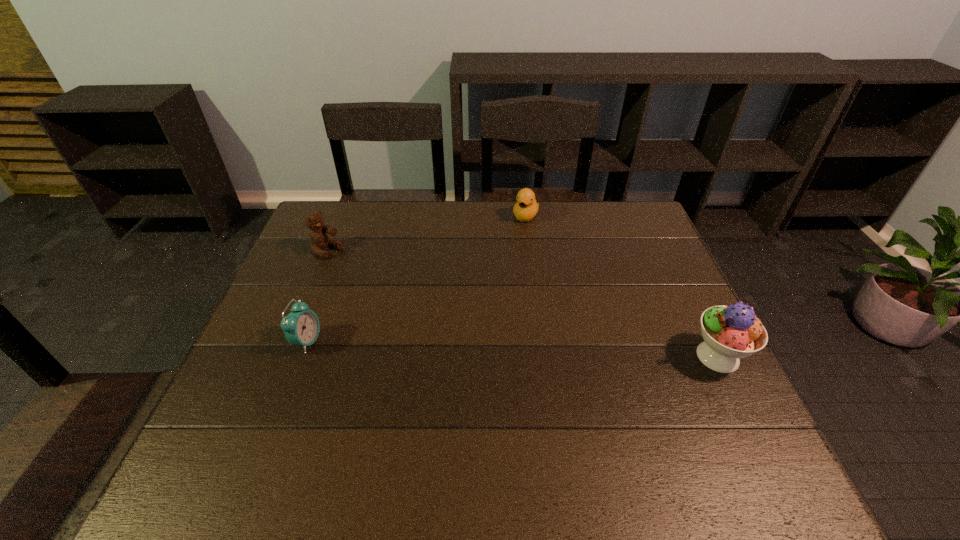
What are the coordinates of `free space located 0.220m on the face of the duckling` in the screenshot? It's located at (506, 267).

I want to click on vacant point located 0.370m on the face of the teddy bear, so click(425, 313).

In order to click on vacant space located on the face of the teddy bear in this screenshot , I will do `click(387, 288)`.

This screenshot has height=540, width=960. Identify the location of vacant space located 0.050m on the face of the teddy bear. (348, 264).

I want to click on duckling positioned at the far edge, so click(x=526, y=207).

Identify the location of teddy bear that is positioned at the far edge. (319, 239).

Image resolution: width=960 pixels, height=540 pixels. I want to click on alarm clock at the left edge, so click(301, 327).

Identify the location of teddy bear that is at the left edge. (319, 239).

Image resolution: width=960 pixels, height=540 pixels. In order to click on object that is at the right edge in this screenshot , I will do `click(731, 332)`.

You are a GUI agent. You are given a task and a screenshot of the screen. Output one action in this format:
    pyautogui.click(x=<x>, y=<y>)
    Task: Click on the object that is at the far left corner
    The width and height of the screenshot is (960, 540).
    Given the screenshot: What is the action you would take?
    pyautogui.click(x=319, y=239)